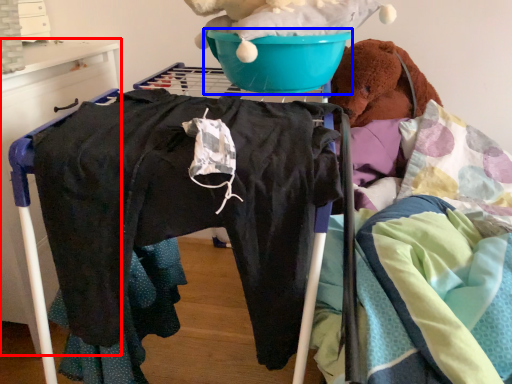
Question: Which of the following is the farthest to the observer, furniture (highlighted by a red box) or basin (highlighted by a blue box)?

Choices:
 (A) furniture
 (B) basin

Answer: (A)